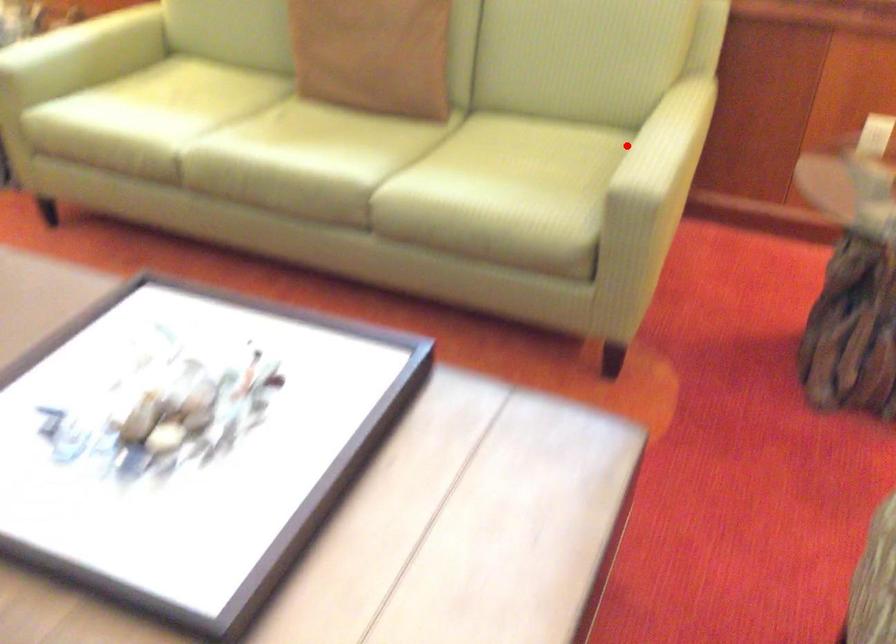
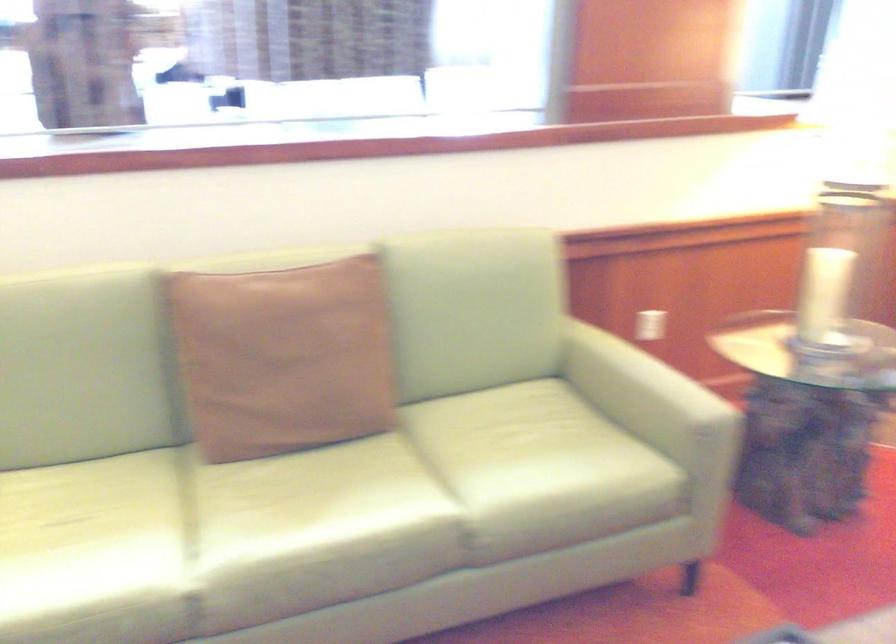
In the second image, find the point that corresponds to the highlighted location in the first image.

(640, 386)